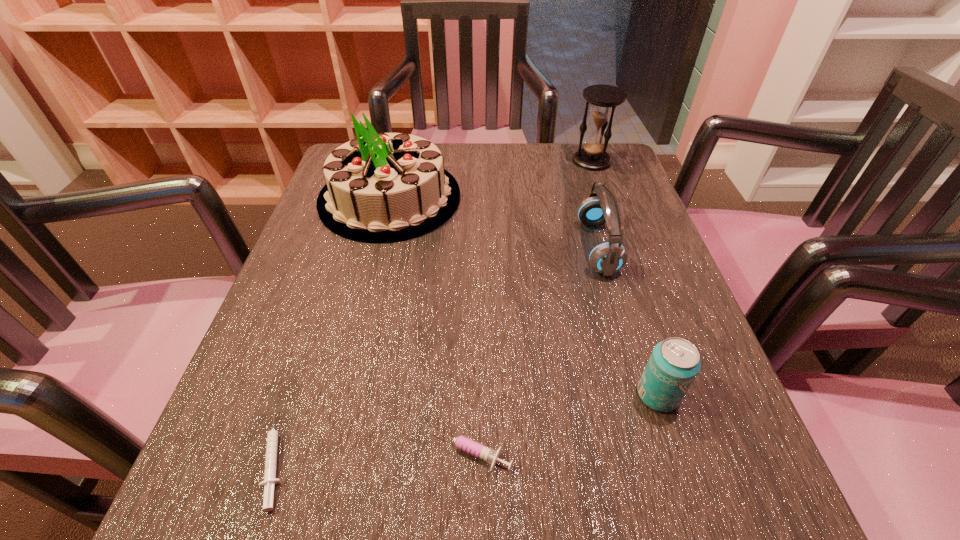
Where is `free spot at the near left corner of the desktop`? free spot at the near left corner of the desktop is located at coordinates (240, 517).

Find the location of `vacant region at the near right corner of the desktop`. vacant region at the near right corner of the desktop is located at coordinates (677, 519).

The image size is (960, 540). In order to click on vacant area that lies between the taller syringe and the fourth shortest object in this screenshot , I will do `click(533, 349)`.

Identify the location of vacant region between the taller syringe and the hourglass. (530, 306).

The image size is (960, 540). I want to click on vacant area that lies between the birthday cake and the headset, so click(x=493, y=222).

At what (x,y) coordinates should I click in order to perform the action: click on free point between the fourth tallest object and the headset. Please return your answer as a coordinate pair (x, y). The image size is (960, 540). Looking at the image, I should click on (628, 321).

What are the coordinates of `unoccupied area between the birthday cake and the right syringe` in the screenshot? It's located at (429, 325).

Identify the location of unoccupied area between the headset and the tallest object. (493, 222).

You are a GUI agent. You are given a task and a screenshot of the screen. Output one action in this format:
    pyautogui.click(x=<x>, y=<y>)
    Task: Click on the empty space that is in between the second shortest object and the fourth tallest object
    
    Given the screenshot: What is the action you would take?
    pyautogui.click(x=563, y=423)

Where is `unoccupied position between the taller syringe and the headset`? This screenshot has width=960, height=540. unoccupied position between the taller syringe and the headset is located at coordinates (533, 349).